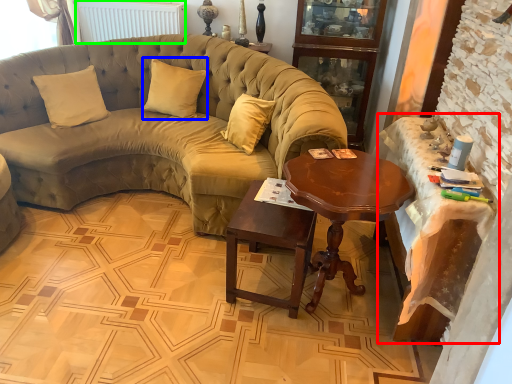
Question: Estimate the real-world distances between objects in this image. Which object is closer to table (highlighted by a red box), pillow (highlighted by a blue box) or radiator (highlighted by a green box)?

Choices:
 (A) pillow
 (B) radiator

Answer: (A)